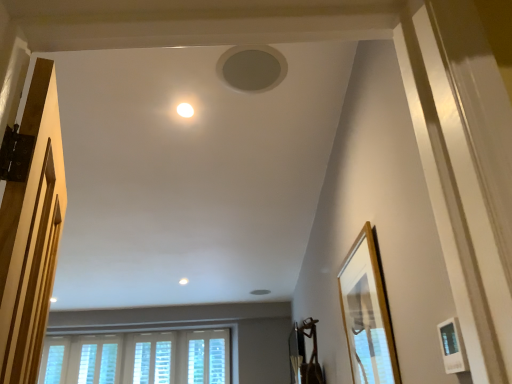
This screenshot has width=512, height=384. Find the location of `wooden picture frame at right, the 2th picture frame when ordered from front to back`. wooden picture frame at right, the 2th picture frame when ordered from front to back is located at coordinates (367, 314).

What do you see at coordinates (367, 314) in the screenshot? I see `wooden picture frame at right, the 2th picture frame when ordered from front to back` at bounding box center [367, 314].

Locate an element on the screen. This screenshot has height=384, width=512. white textured window at lower center, acting as the fourth window starting from the left is located at coordinates (217, 361).

How much space does matte gray speaker at upper center, which ranks as the 2th hole in bottom-to-top order, occupy horizontally?

matte gray speaker at upper center, which ranks as the 2th hole in bottom-to-top order, is 10.05 inches in width.

In order to face white textured window at lower left, which ranks as the third window in right-to-left order, should I rotate leftwards or rightwards?

Turn left by 20.484 degrees to look at white textured window at lower left, which ranks as the third window in right-to-left order.

Image resolution: width=512 pixels, height=384 pixels. What do you see at coordinates (152, 362) in the screenshot?
I see `white textured blinds at lower center, which ranks as the 2th window in right-to-left order` at bounding box center [152, 362].

You are a GUI agent. You are given a task and a screenshot of the screen. Output one action in this format:
    pyautogui.click(x=<x>, y=<y>)
    Task: Click on the wooden picture frame at right, which is counted as the 1th picture frame, starting from the back
    
    Given the screenshot: What is the action you would take?
    pyautogui.click(x=367, y=314)

What's the angular difference between white matte hole at upper center, which is counted as the 2th hole, starting from the top, and white textured window at lower left, the 4th window viewed from the right,'s facing directions?

91.1 degrees.

Does white matte hole at upper center, which is counted as the 2th hole, starting from the top, have a greater height compared to white textured window at lower left, positioned as the 1th window in left-to-right order?

No, white matte hole at upper center, which is counted as the 2th hole, starting from the top, is not taller than white textured window at lower left, positioned as the 1th window in left-to-right order.

Consider the image. Does white matte hole at upper center, positioned as the second hole in front-to-back order, appear on the left side of white textured window at lower left, the 4th window viewed from the right?

In fact, white matte hole at upper center, positioned as the second hole in front-to-back order, is to the right of white textured window at lower left, the 4th window viewed from the right.

Is white matte hole at upper center, which is counted as the 2th hole, starting from the top, aimed at white textured window at lower left, the 4th window viewed from the right?

No, white matte hole at upper center, which is counted as the 2th hole, starting from the top, does not turn towards white textured window at lower left, the 4th window viewed from the right.

From the image's perspective, which one is positioned lower, white glossy light fixture at upper center or white matte picture frame at lower right, which ranks as the 1th picture frame in front-to-back order?

white matte picture frame at lower right, which ranks as the 1th picture frame in front-to-back order.

Would you consider white glossy light fixture at upper center to be distant from white matte picture frame at lower right, arranged as the 2th picture frame when viewed from the back?

Yes, white glossy light fixture at upper center and white matte picture frame at lower right, arranged as the 2th picture frame when viewed from the back, are located far from each other.

Consider the image. Between white glossy light fixture at upper center and white matte picture frame at lower right, which ranks as the 1th picture frame in front-to-back order, which one appears on the left side from the viewer's perspective?

white glossy light fixture at upper center.

Consider the image. Which is farther from the camera, (181,112) or (464,351)?

Positioned behind is point (181,112).

Between matte gray speaker at upper center, which ranks as the 2th hole in bottom-to-top order, and white matte picture frame at lower right, which ranks as the 1th picture frame in front-to-back order, which one is positioned behind?

matte gray speaker at upper center, which ranks as the 2th hole in bottom-to-top order, is more distant.

From the image's perspective, is matte gray speaker at upper center, which appears as the 1th hole when viewed from the top, above white matte picture frame at lower right, which ranks as the 1th picture frame in front-to-back order?

Yes, from the image's perspective, matte gray speaker at upper center, which appears as the 1th hole when viewed from the top, is on top of white matte picture frame at lower right, which ranks as the 1th picture frame in front-to-back order.

Would you say matte gray speaker at upper center, which ranks as the 2th hole in bottom-to-top order, is to the left or to the right of white matte picture frame at lower right, which ranks as the 1th picture frame in front-to-back order, in the picture?

Clearly, matte gray speaker at upper center, which ranks as the 2th hole in bottom-to-top order, is on the left of white matte picture frame at lower right, which ranks as the 1th picture frame in front-to-back order, in the image.

Looking at this image, choose the correct answer: Is matte gray speaker at upper center, acting as the second hole starting from the back, inside white matte picture frame at lower right, which ranks as the 1th picture frame in front-to-back order, or outside it?

matte gray speaker at upper center, acting as the second hole starting from the back, exists outside the volume of white matte picture frame at lower right, which ranks as the 1th picture frame in front-to-back order.

From a real-world perspective, is white matte hole at upper center, the first hole viewed from the back, above or below white textured blinds at lower center, which ranks as the 2th window in right-to-left order?

white matte hole at upper center, the first hole viewed from the back, is above white textured blinds at lower center, which ranks as the 2th window in right-to-left order.

Looking at this image, is white matte hole at upper center, the first hole when ordered from bottom to top, not inside white textured blinds at lower center, which ranks as the 2th window in right-to-left order?

Yes, white matte hole at upper center, the first hole when ordered from bottom to top, is not within white textured blinds at lower center, which ranks as the 2th window in right-to-left order.

Is the surface of white matte hole at upper center, the first hole viewed from the back, in direct contact with white textured blinds at lower center, the third window from the left?

No, white matte hole at upper center, the first hole viewed from the back, is not next to white textured blinds at lower center, the third window from the left.

Is white matte hole at upper center, the first hole viewed from the back, to the left of white textured blinds at lower center, which ranks as the 2th window in right-to-left order, from the viewer's perspective?

No, white matte hole at upper center, the first hole viewed from the back, is not to the left of white textured blinds at lower center, which ranks as the 2th window in right-to-left order.

How many degrees apart are the facing directions of wooden picture frame at right, the 2th picture frame when ordered from front to back, and white textured blinds at lower center, the third window from the left?

The angular difference between wooden picture frame at right, the 2th picture frame when ordered from front to back, and white textured blinds at lower center, the third window from the left, is 94.8 degrees.

Considering the positions of objects wooden picture frame at right, the 2th picture frame when ordered from front to back, and white textured blinds at lower center, the third window from the left, in the image provided, who is more to the left, wooden picture frame at right, the 2th picture frame when ordered from front to back, or white textured blinds at lower center, the third window from the left,?

Positioned to the left is white textured blinds at lower center, the third window from the left.

Is wooden picture frame at right, which is counted as the 1th picture frame, starting from the back, turned away from white textured blinds at lower center, which ranks as the 2th window in right-to-left order?

wooden picture frame at right, which is counted as the 1th picture frame, starting from the back, is not turned away from white textured blinds at lower center, which ranks as the 2th window in right-to-left order.

Is wooden picture frame at right, which is counted as the 1th picture frame, starting from the back, spatially inside white textured blinds at lower center, the third window from the left, or outside of it?

The correct answer is: outside.

Considering the relative sizes of white textured window at lower center, acting as the fourth window starting from the left, and white textured window at lower left, positioned as the 1th window in left-to-right order, in the image provided, is white textured window at lower center, acting as the fourth window starting from the left, bigger than white textured window at lower left, positioned as the 1th window in left-to-right order,?

Yes.

From a real-world perspective, who is located higher, white textured window at lower center, arranged as the 1th window when viewed from the right, or white textured window at lower left, the 4th window viewed from the right?

white textured window at lower left, the 4th window viewed from the right, is physically above.

Is white textured window at lower center, acting as the fourth window starting from the left, inside or outside of white textured window at lower left, positioned as the 1th window in left-to-right order?

white textured window at lower center, acting as the fourth window starting from the left, is not enclosed by white textured window at lower left, positioned as the 1th window in left-to-right order.

From the image's perspective, which one is positioned higher, white textured window at lower center, arranged as the 1th window when viewed from the right, or white textured window at lower left, positioned as the 1th window in left-to-right order?

white textured window at lower center, arranged as the 1th window when viewed from the right.

Could you tell me if white matte picture frame at lower right, which ranks as the 1th picture frame in front-to-back order, is facing white glossy light fixture at upper center?

No.

Which is in front, white matte picture frame at lower right, arranged as the 2th picture frame when viewed from the back, or white glossy light fixture at upper center?

Positioned in front is white matte picture frame at lower right, arranged as the 2th picture frame when viewed from the back.

Are white matte picture frame at lower right, arranged as the 2th picture frame when viewed from the back, and white glossy light fixture at upper center far apart?

Absolutely, white matte picture frame at lower right, arranged as the 2th picture frame when viewed from the back, is distant from white glossy light fixture at upper center.

Which of these two, white matte picture frame at lower right, which ranks as the 1th picture frame in front-to-back order, or white glossy light fixture at upper center, is smaller?

white glossy light fixture at upper center is smaller.

The width and height of the screenshot is (512, 384). In order to click on hole that is the 1st one when counting forward from the white textured window at lower left, the 4th window viewed from the right in this screenshot , I will do `click(260, 292)`.

Locate an element on the screen. lighting above the white matte picture frame at lower right, which ranks as the 1th picture frame in front-to-back order (from a real-world perspective) is located at coordinates (185, 110).

In the scene shown: Considering their positions, is matte gray speaker at upper center, which appears as the 1th hole when viewed from the top, positioned further to white textured window at lower left, the 4th window viewed from the right, than white matte hole at upper center, the first hole when ordered from bottom to top?

matte gray speaker at upper center, which appears as the 1th hole when viewed from the top, is positioned further to the anchor white textured window at lower left, the 4th window viewed from the right.

Considering their positions, is white textured window at lower left, which appears as the second window when viewed from the left, positioned closer to white matte picture frame at lower right, which ranks as the 1th picture frame in front-to-back order, than matte gray speaker at upper center, which appears as the 1th hole when viewed from the top?

Based on the image, matte gray speaker at upper center, which appears as the 1th hole when viewed from the top, appears to be nearer to white matte picture frame at lower right, which ranks as the 1th picture frame in front-to-back order.

Considering their positions, is white textured blinds at lower center, the third window from the left, positioned closer to matte gray speaker at upper center, acting as the second hole starting from the back, than white glossy light fixture at upper center?

Based on the image, white glossy light fixture at upper center appears to be nearer to matte gray speaker at upper center, acting as the second hole starting from the back.

Based on their spatial positions, is white textured window at lower left, positioned as the 1th window in left-to-right order, or white textured window at lower center, acting as the fourth window starting from the left, further from white matte hole at upper center, the first hole when ordered from bottom to top?

white textured window at lower left, positioned as the 1th window in left-to-right order, is further to white matte hole at upper center, the first hole when ordered from bottom to top.

From the picture: Which object lies nearer to the anchor point white matte hole at upper center, the first hole when ordered from bottom to top, white glossy light fixture at upper center or white matte picture frame at lower right, arranged as the 2th picture frame when viewed from the back?

white glossy light fixture at upper center is positioned closer to the anchor white matte hole at upper center, the first hole when ordered from bottom to top.

Based on their spatial positions, is white textured window at lower left, which ranks as the third window in right-to-left order, or white matte hole at upper center, which is counted as the 2th hole, starting from the top, further from matte gray speaker at upper center, which is the first hole in front-to-back order?

white textured window at lower left, which ranks as the third window in right-to-left order.

Which object lies further to the anchor point white textured blinds at lower center, which ranks as the 2th window in right-to-left order, white matte picture frame at lower right, arranged as the 2th picture frame when viewed from the back, or white textured window at lower center, acting as the fourth window starting from the left?

white matte picture frame at lower right, arranged as the 2th picture frame when viewed from the back.

Based on their spatial positions, is white glossy light fixture at upper center or matte gray speaker at upper center, which appears as the 1th hole when viewed from the top, closer to white textured window at lower left, positioned as the 1th window in left-to-right order?

white glossy light fixture at upper center lies closer to white textured window at lower left, positioned as the 1th window in left-to-right order, than the other object.

In order to click on lighting between wooden picture frame at right, the 2th picture frame when ordered from front to back, and white textured window at lower center, arranged as the 1th window when viewed from the right, in the front-back direction in this screenshot , I will do `click(185, 110)`.

Identify the location of lighting between wooden picture frame at right, which is counted as the 1th picture frame, starting from the back, and white textured window at lower left, which appears as the second window when viewed from the left, in the front-back direction. This screenshot has width=512, height=384. coord(185,110).

Identify the location of lighting between white matte picture frame at lower right, which ranks as the 1th picture frame in front-to-back order, and white matte hole at upper center, the first hole viewed from the back, from front to back. The image size is (512, 384). (185, 110).

This screenshot has height=384, width=512. In order to click on hole between matte gray speaker at upper center, which appears as the 1th hole when viewed from the top, and white textured window at lower left, which ranks as the third window in right-to-left order, in the front-back direction in this screenshot , I will do `click(260, 292)`.